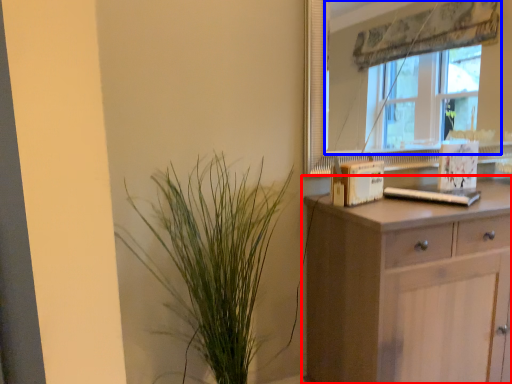
Question: Which object appears closest to the camera in this image, chest of drawers (highlighted by a red box) or window (highlighted by a blue box)?

Choices:
 (A) chest of drawers
 (B) window

Answer: (A)